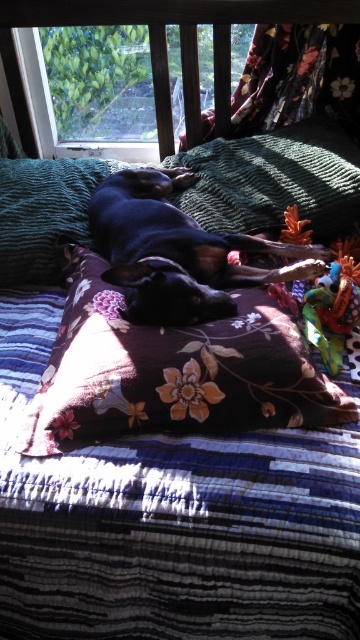
Question: Can you confirm if clear glass window at upper center is smaller than black smooth dog at center?

Choices:
 (A) yes
 (B) no

Answer: (A)

Question: Considering the real-world distances, which object is farthest from the floral fabric pillow at center?

Choices:
 (A) fluffy teal blanket at upper center
 (B) black smooth dog at center

Answer: (A)

Question: Can you confirm if floral fabric pillow at center is positioned below black smooth dog at center?

Choices:
 (A) yes
 (B) no

Answer: (A)

Question: Which point is closer to the camera taking this photo?

Choices:
 (A) 182,358
 (B) 47,83
 (C) 108,196

Answer: (A)

Question: Which of the following is the closest to the observer?

Choices:
 (A) clear glass window at upper center
 (B) floral fabric pillow at center
 (C) black smooth dog at center
 (D) fluffy teal blanket at upper center

Answer: (B)

Question: Where is floral fabric pillow at center located in relation to fluffy teal blanket at upper center in the image?

Choices:
 (A) left
 (B) right

Answer: (B)